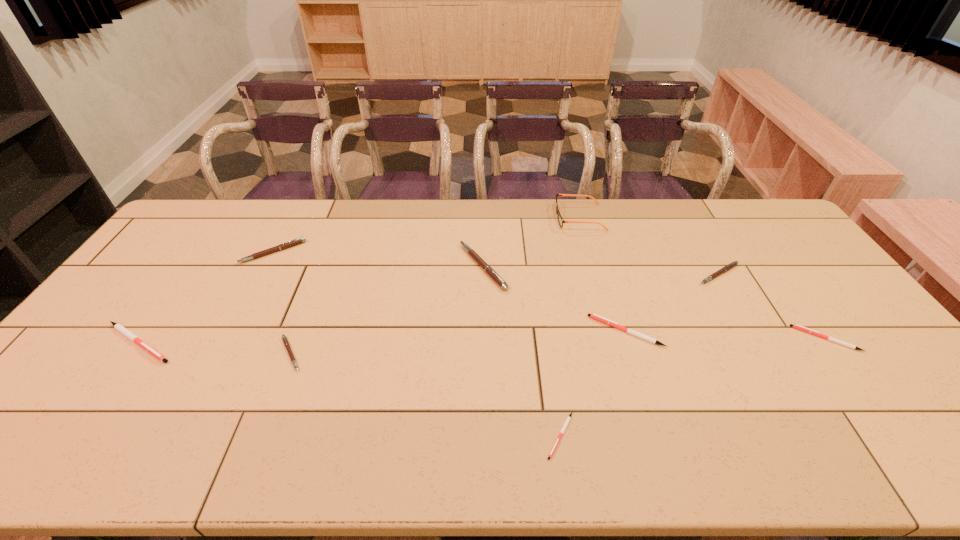
Where is `free spot between the second biggest white pen and the second pink pen from right to left`? free spot between the second biggest white pen and the second pink pen from right to left is located at coordinates pos(555,299).

Where is `empty space that is in between the eighth object from left to right and the leftmost pink pen`? This screenshot has height=540, width=960. empty space that is in between the eighth object from left to right and the leftmost pink pen is located at coordinates (495, 263).

The image size is (960, 540). In order to click on object that ranks as the closest to the second pink pen from left to right in this screenshot , I will do `click(120, 328)`.

Identify which object is the eighth closest to the tallest object. Please provide its 2D coordinates. Your answer should be formatted as a tuple, i.e. [(x, y)], where the tuple contains the x and y coordinates of a point satisfying the conditions above.

[(120, 328)]

Identify the location of pen that is the third closest one to the tallest object. click(614, 324).

Identify the location of pen that can be found as the fifth closest to the shortest pen. This screenshot has width=960, height=540. (796, 326).

You are a GUI agent. You are given a task and a screenshot of the screen. Output one action in this format:
    pyautogui.click(x=<x>, y=<y>)
    Task: Click on the pink pen that is the closest to the third white pen from left to right
    
    Given the screenshot: What is the action you would take?
    pyautogui.click(x=731, y=265)

In order to click on pink pen that is the closest one to the third pink pen from left to right in this screenshot , I will do `click(286, 343)`.

Where is `white pen that is the second nearest to the rightmost white pen`? Image resolution: width=960 pixels, height=540 pixels. white pen that is the second nearest to the rightmost white pen is located at coordinates (569, 417).

Where is `white pen that is the fourth closest one to the tallest object`? white pen that is the fourth closest one to the tallest object is located at coordinates (120, 328).